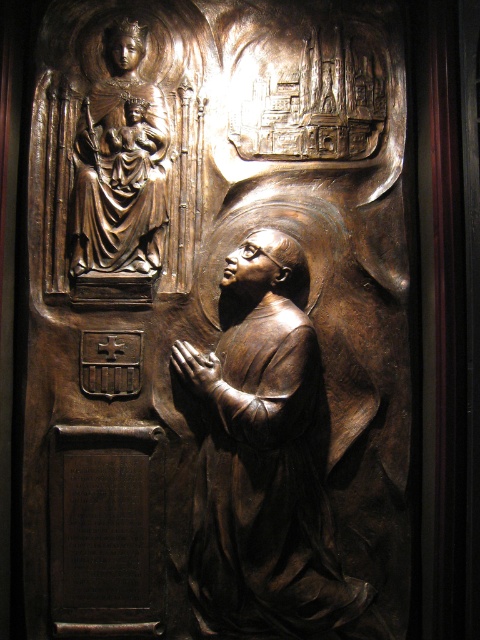
Question: Which of the following is the closest to the observer?

Choices:
 (A) bronze statue at center
 (B) bronze statue of madonna and child at upper left

Answer: (A)

Question: Considering the relative positions of bronze statue at center and bronze statue of madonna and child at upper left in the image provided, where is bronze statue at center located with respect to bronze statue of madonna and child at upper left?

Choices:
 (A) right
 (B) left

Answer: (A)

Question: Which point is closer to the camera?

Choices:
 (A) bronze statue at center
 (B) bronze statue of madonna and child at upper left

Answer: (A)

Question: Which of the following is the closest to the observer?

Choices:
 (A) (249, 296)
 (B) (121, 140)

Answer: (A)

Question: Does bronze statue at center appear under bronze statue of madonna and child at upper left?

Choices:
 (A) no
 (B) yes

Answer: (B)

Question: From the image, what is the correct spatial relationship of bronze statue at center in relation to bronze statue of madonna and child at upper left?

Choices:
 (A) left
 (B) right

Answer: (B)